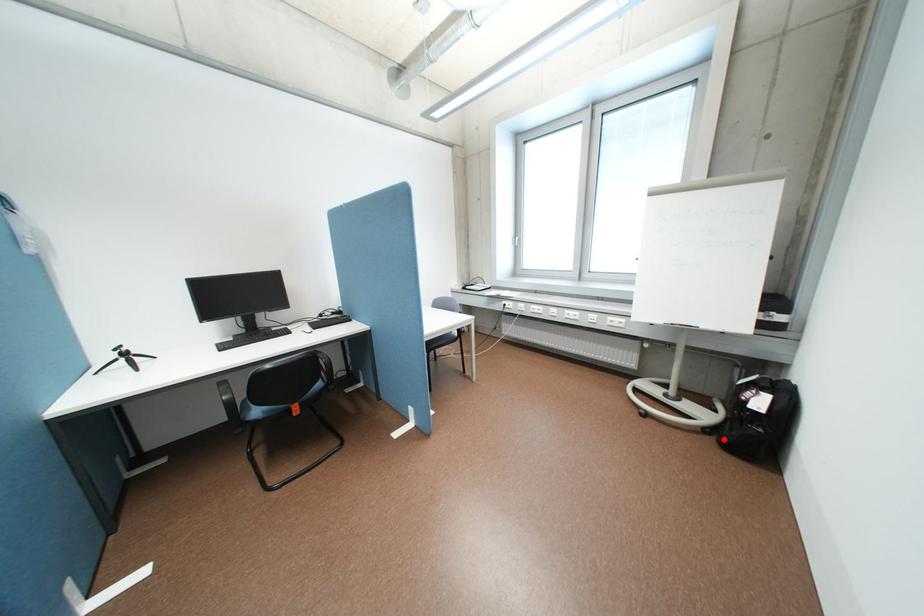
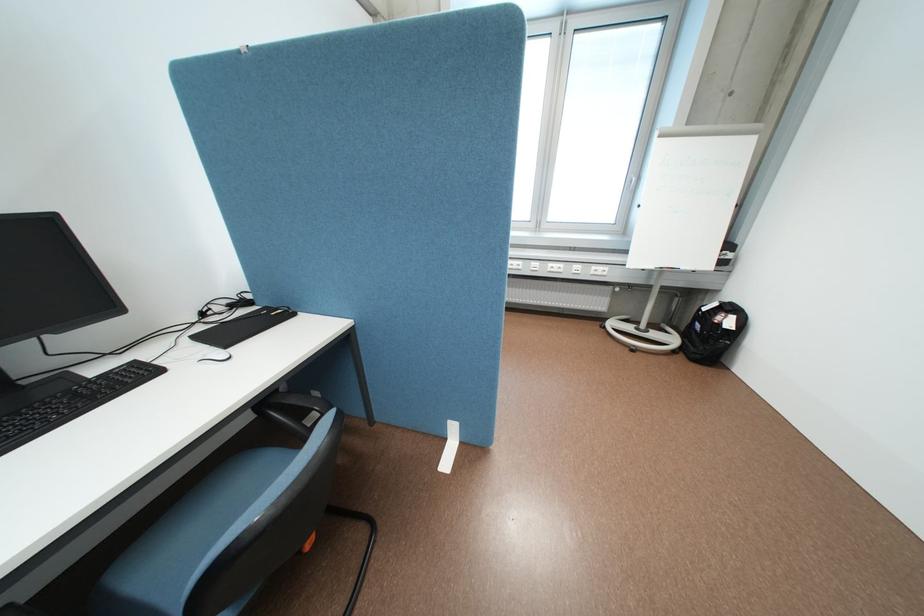
Locate, in the second image, the point that corresponds to the highlighted location in the first image.

(691, 357)